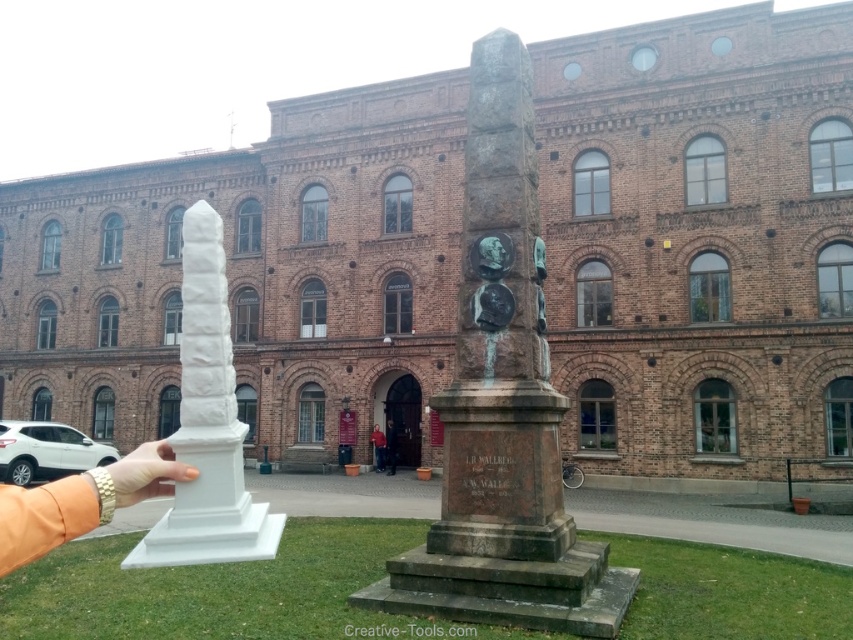
Question: Which object appears closest to the camera in this image?

Choices:
 (A) red sweater at center
 (B) bronze/stone column at center
 (C) white marble obelisk at center

Answer: (C)

Question: Which object is the farthest from the bronze/stone column at center?

Choices:
 (A) white marble obelisk at center
 (B) white plastic hand at lower left
 (C) white matte hand at lower left
 (D) red sweater at center

Answer: (D)

Question: Which object appears closest to the camera in this image?

Choices:
 (A) white matte hand at lower left
 (B) red sweater at center

Answer: (A)

Question: Does bronze/textured monument at center have a larger size compared to white matte hand at lower left?

Choices:
 (A) no
 (B) yes

Answer: (A)

Question: Does bronze/textured monument at center appear on the left side of white matte hand at lower left?

Choices:
 (A) no
 (B) yes

Answer: (A)

Question: In this image, where is white matte hand at lower left located relative to dark blue jeans at center?

Choices:
 (A) right
 (B) left

Answer: (B)